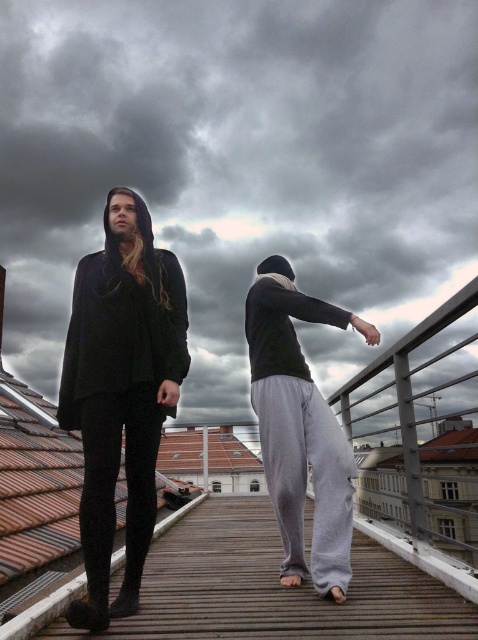
You are a photographer positioned at point (120, 392). You want to capture a photo of the matte black hoodie at center and the individual on the right. Which direction should you move to ensure both subjects are in frame?

The point (120, 392) marks the matte black hoodie at center, so you should move towards the right to include the individual on the right in the frame.

You are a photographer planning to take a portrait of the two people on the wooden platform. You want to ensure the matte black cape at left is centered in the frame. Where should you position the camera relative to the individuals?

To center the matte black cape at left in the frame, position the camera at point (120,392) relative to the individuals.

You are standing on the wooden platform and want to reach the point at coordinates point (147, 420). If you take a step forward, will you be closer to the camera or farther away?

A: The point (147, 420) is 2.64 meters away from the camera. Taking a step forward would decrease the distance, so you would be closer to the camera.